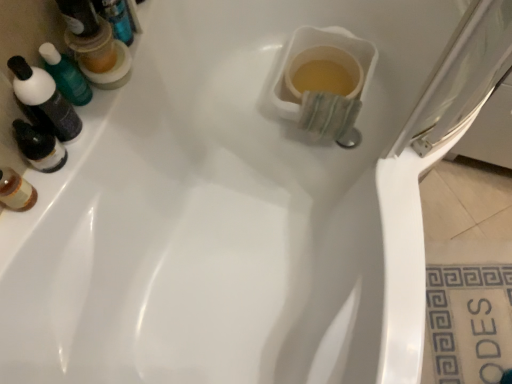
This screenshot has height=384, width=512. Identify the location of translucent plastic mouthwash at upper left, the second mouthwash from the top. (44, 100).

The image size is (512, 384). What do you see at coordinates (462, 78) in the screenshot?
I see `transparent plastic screen door at upper right` at bounding box center [462, 78].

In order to face translucent plastic mouthwash at upper left, which is counted as the 1th mouthwash, starting from the top, should I rotate leftwards or rightwards?

To align with it, rotate left about 21.224°.

Image resolution: width=512 pixels, height=384 pixels. Identify the location of translucent plastic mouthwash at upper left, the second mouthwash from the top. (44, 100).

Does point (449, 111) appear closer or farther from the camera than point (40, 105)?

Point (449, 111) appears to be closer to the viewer than point (40, 105).

Based on their positions, is transparent plastic screen door at upper right located to the left or right of translucent plastic mouthwash at upper left, which appears as the first mouthwash when ordered from the bottom?

Based on their positions, transparent plastic screen door at upper right is located to the right of translucent plastic mouthwash at upper left, which appears as the first mouthwash when ordered from the bottom.

This screenshot has height=384, width=512. In order to click on mouthwash that is the 2nd object above the transparent plastic screen door at upper right (from a real-world perspective) in this screenshot , I will do `click(44, 100)`.

Is transparent plastic screen door at upper right turned away from translucent plastic mouthwash at upper left, which appears as the first mouthwash when ordered from the bottom?

No, transparent plastic screen door at upper right is not facing the opposite direction of translucent plastic mouthwash at upper left, which appears as the first mouthwash when ordered from the bottom.

Considering the relative sizes of transparent plastic screen door at upper right and translucent plastic mouthwash at upper left, which appears as the 2th mouthwash when ordered from the bottom, in the image provided, is transparent plastic screen door at upper right smaller than translucent plastic mouthwash at upper left, which appears as the 2th mouthwash when ordered from the bottom,?

No, transparent plastic screen door at upper right is not smaller than translucent plastic mouthwash at upper left, which appears as the 2th mouthwash when ordered from the bottom.

Would you consider transparent plastic screen door at upper right to be distant from translucent plastic mouthwash at upper left, which is counted as the 1th mouthwash, starting from the top?

transparent plastic screen door at upper right is near translucent plastic mouthwash at upper left, which is counted as the 1th mouthwash, starting from the top, not far away.

Consider the image. From a real-world perspective, which object rests below the other?

In real-world perspective, transparent plastic screen door at upper right is lower.

Is point (51, 129) more distant than point (114, 82)?

No, (51, 129) is in front of (114, 82).

How many degrees apart are the facing directions of translucent plastic mouthwash at upper left, the second mouthwash from the top, and translucent plastic mouthwash at upper left, which is counted as the 1th mouthwash, starting from the top?

The angular difference between translucent plastic mouthwash at upper left, the second mouthwash from the top, and translucent plastic mouthwash at upper left, which is counted as the 1th mouthwash, starting from the top, is 0.000101 degrees.

In terms of height, does translucent plastic mouthwash at upper left, which appears as the first mouthwash when ordered from the bottom, look taller or shorter compared to translucent plastic mouthwash at upper left, which appears as the 2th mouthwash when ordered from the bottom?

Clearly, translucent plastic mouthwash at upper left, which appears as the first mouthwash when ordered from the bottom, is taller compared to translucent plastic mouthwash at upper left, which appears as the 2th mouthwash when ordered from the bottom.

Is white ceramic tile at lower right facing towards transparent plastic screen door at upper right?

No, white ceramic tile at lower right does not turn towards transparent plastic screen door at upper right.

Is white ceramic tile at lower right in contact with transparent plastic screen door at upper right?

No, white ceramic tile at lower right is not making contact with transparent plastic screen door at upper right.

Is point (464, 367) positioned in front of point (428, 121)?

No, it is behind (428, 121).

From the image's perspective, is white ceramic tile at lower right on top of transparent plastic screen door at upper right?

No, from the image's perspective, white ceramic tile at lower right is not above transparent plastic screen door at upper right.

In the image, is translucent plastic mouthwash at upper left, which is counted as the 1th mouthwash, starting from the top, positioned in front of or behind transparent plastic screen door at upper right?

translucent plastic mouthwash at upper left, which is counted as the 1th mouthwash, starting from the top, is in front of transparent plastic screen door at upper right.

Locate an element on the screen. The image size is (512, 384). screen door on the right of translucent plastic mouthwash at upper left, which is counted as the 1th mouthwash, starting from the top is located at coordinates (462, 78).

Based on the photo, is translucent plastic mouthwash at upper left, which appears as the 2th mouthwash when ordered from the bottom, directly adjacent to transparent plastic screen door at upper right?

No.

From the picture: How different are the orientations of translucent plastic mouthwash at upper left, the second mouthwash from the top, and transparent plastic screen door at upper right in degrees?

The facing directions of translucent plastic mouthwash at upper left, the second mouthwash from the top, and transparent plastic screen door at upper right are 84.6 degrees apart.

Which object is positioned more to the right, translucent plastic mouthwash at upper left, which appears as the first mouthwash when ordered from the bottom, or transparent plastic screen door at upper right?

Positioned to the right is transparent plastic screen door at upper right.

Does translucent plastic mouthwash at upper left, which appears as the first mouthwash when ordered from the bottom, have a lesser width compared to transparent plastic screen door at upper right?

Yes, translucent plastic mouthwash at upper left, which appears as the first mouthwash when ordered from the bottom, is thinner than transparent plastic screen door at upper right.

Based on the photo, could you tell me if translucent plastic mouthwash at upper left, the second mouthwash from the top, is turned towards transparent plastic screen door at upper right?

No, translucent plastic mouthwash at upper left, the second mouthwash from the top, is not turned towards transparent plastic screen door at upper right.

From a real-world perspective, is white ceramic tile at lower right on translucent plastic mouthwash at upper left, which is counted as the 1th mouthwash, starting from the top?

No, from a real-world perspective, white ceramic tile at lower right is not over translucent plastic mouthwash at upper left, which is counted as the 1th mouthwash, starting from the top

From the image's perspective, is white ceramic tile at lower right above or below translucent plastic mouthwash at upper left, which appears as the 2th mouthwash when ordered from the bottom?

From the image's perspective, white ceramic tile at lower right appears below translucent plastic mouthwash at upper left, which appears as the 2th mouthwash when ordered from the bottom.

How much distance is there between white ceramic tile at lower right and translucent plastic mouthwash at upper left, which appears as the 2th mouthwash when ordered from the bottom?

A distance of 1.16 meters exists between white ceramic tile at lower right and translucent plastic mouthwash at upper left, which appears as the 2th mouthwash when ordered from the bottom.

This screenshot has width=512, height=384. I want to click on tile lying on the right of translucent plastic mouthwash at upper left, which is counted as the 1th mouthwash, starting from the top, so click(x=468, y=323).

The width and height of the screenshot is (512, 384). I want to click on screen door located above the translucent plastic mouthwash at upper left, which appears as the first mouthwash when ordered from the bottom (from the image's perspective), so click(x=462, y=78).

Where is `screen door located underneath the translucent plastic mouthwash at upper left, which is counted as the 1th mouthwash, starting from the top (from a real-world perspective)`? The image size is (512, 384). screen door located underneath the translucent plastic mouthwash at upper left, which is counted as the 1th mouthwash, starting from the top (from a real-world perspective) is located at coordinates pos(462,78).

Based on their spatial positions, is white ceramic tile at lower right or translucent plastic mouthwash at upper left, which appears as the first mouthwash when ordered from the bottom, closer to transparent plastic screen door at upper right?

Based on the image, translucent plastic mouthwash at upper left, which appears as the first mouthwash when ordered from the bottom, appears to be nearer to transparent plastic screen door at upper right.

Which object lies further to the anchor point white ceramic tile at lower right, translucent plastic mouthwash at upper left, which is counted as the 1th mouthwash, starting from the top, or translucent plastic mouthwash at upper left, which appears as the first mouthwash when ordered from the bottom?

translucent plastic mouthwash at upper left, which appears as the first mouthwash when ordered from the bottom.

Which object lies nearer to the anchor point translucent plastic mouthwash at upper left, which is counted as the 1th mouthwash, starting from the top, translucent plastic mouthwash at upper left, which appears as the first mouthwash when ordered from the bottom, or transparent plastic screen door at upper right?

translucent plastic mouthwash at upper left, which appears as the first mouthwash when ordered from the bottom, lies closer to translucent plastic mouthwash at upper left, which is counted as the 1th mouthwash, starting from the top, than the other object.

From the image, which object appears to be farther from translucent plastic mouthwash at upper left, the second mouthwash from the top, white ceramic tile at lower right or transparent plastic screen door at upper right?

white ceramic tile at lower right lies further to translucent plastic mouthwash at upper left, the second mouthwash from the top, than the other object.

Estimate the real-world distances between objects in this image. Which object is further from transparent plastic screen door at upper right, translucent plastic mouthwash at upper left, the second mouthwash from the top, or white ceramic tile at lower right?

white ceramic tile at lower right.

Which object lies nearer to the anchor point translucent plastic mouthwash at upper left, which is counted as the 1th mouthwash, starting from the top, white ceramic tile at lower right or transparent plastic screen door at upper right?

transparent plastic screen door at upper right is positioned closer to the anchor translucent plastic mouthwash at upper left, which is counted as the 1th mouthwash, starting from the top.

When comparing their distances from translucent plastic mouthwash at upper left, which appears as the 2th mouthwash when ordered from the bottom, does transparent plastic screen door at upper right or translucent plastic mouthwash at upper left, which appears as the first mouthwash when ordered from the bottom, seem further?

The object further to translucent plastic mouthwash at upper left, which appears as the 2th mouthwash when ordered from the bottom, is transparent plastic screen door at upper right.

When comparing their distances from white ceramic tile at lower right, does transparent plastic screen door at upper right or translucent plastic mouthwash at upper left, the second mouthwash from the top, seem further?

Based on the image, translucent plastic mouthwash at upper left, the second mouthwash from the top, appears to be further to white ceramic tile at lower right.

Find the location of a particular element. This screenshot has width=512, height=384. screen door situated between translucent plastic mouthwash at upper left, which is counted as the 1th mouthwash, starting from the top, and white ceramic tile at lower right from left to right is located at coordinates (462, 78).

At what (x,y) coordinates should I click in order to perform the action: click on mouthwash situated between translucent plastic mouthwash at upper left, the second mouthwash from the top, and transparent plastic screen door at upper right from left to right. Please return your answer as a coordinate pair (x, y). This screenshot has height=384, width=512. Looking at the image, I should click on (95, 45).

What are the coordinates of `mouthwash located between translucent plastic mouthwash at upper left, which appears as the first mouthwash when ordered from the bottom, and white ceramic tile at lower right in the left-right direction` in the screenshot? It's located at (95, 45).

Identify the location of screen door between translucent plastic mouthwash at upper left, the second mouthwash from the top, and white ceramic tile at lower right, in the horizontal direction. pyautogui.click(x=462, y=78).